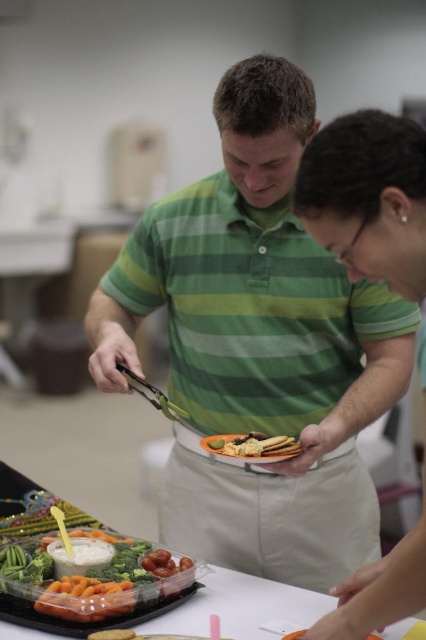
You are a food server at the event. You need to place a new dish on the table between the matte black plate at center and the golden crispy fries at center. Which object should you place it closer to if you want it to be higher up?

You should place the new dish closer to the matte black plate at center because it is located above the golden crispy fries at center.

You are taking a photo of the two people serving food. Which of the two points, point [6,612] or point [287,449], will appear larger in your photo?

Point [6,612] will appear larger in the photo because it is closer to the camera than point [287,449].